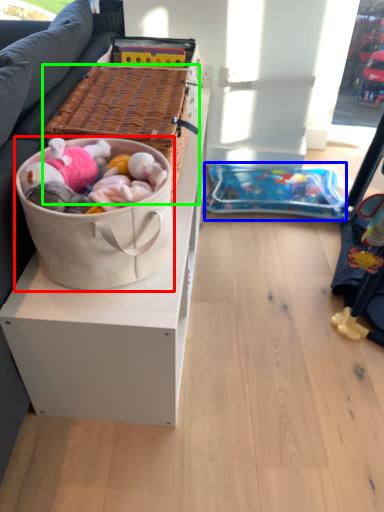
Question: Based on their relative distances, which object is farther from gift basket (highlighted by a red box)? Choose from infant bed (highlighted by a blue box) and picnic basket (highlighted by a green box).

Choices:
 (A) infant bed
 (B) picnic basket

Answer: (A)